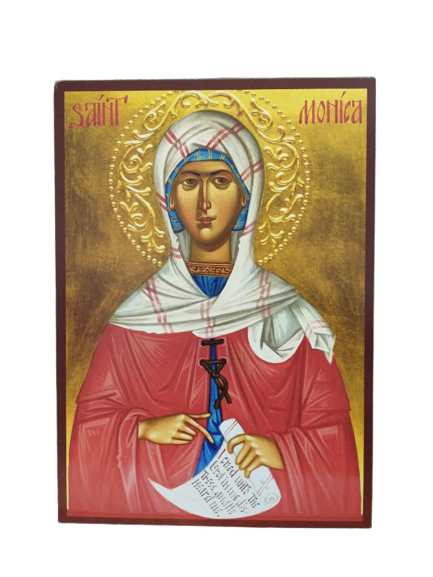
The image size is (433, 577). Find the location of `scrolls`. scrolls is located at coordinates (175, 497).